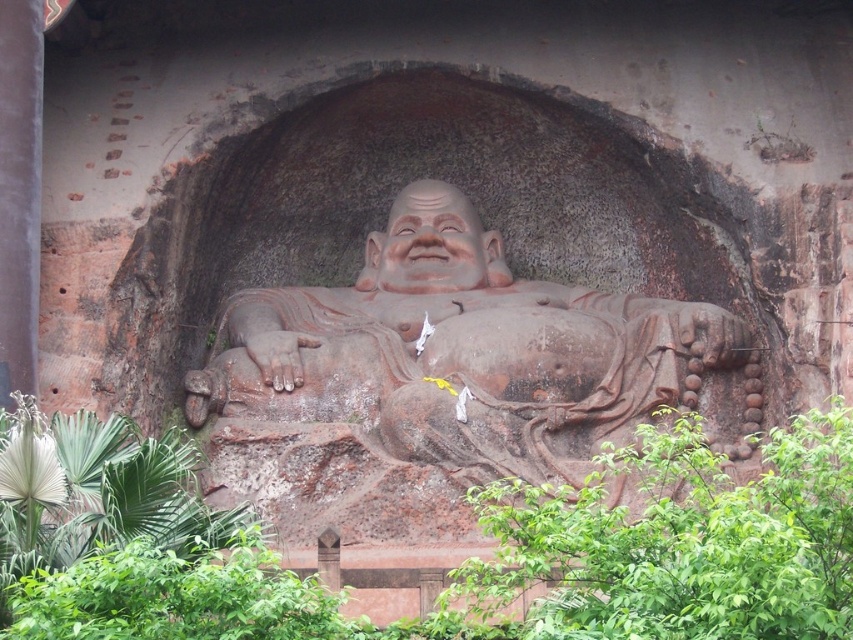
You are a tourist standing in front of the statue of the reclining Buddha. You notice the green leafy plant at lower center and the matte clay face at center. Which object is nearer to you?

The green leafy plant at lower center is closer to the viewer than the matte clay face at center.

You are a tourist standing in front of the statue of the reclining Buddha. You notice two objects in the scene. One is the brown stone statue at center and the other is the matte clay face at center. Which object is positioned to the right of the other?

The brown stone statue at center is to the right of the matte clay face at center.

You are standing at the base of the Buddha statue and want to water the green leafy plant at lower center. If your watering can has a range of 50 meters, will you be able to reach it?

The green leafy plant at lower center and viewer are 49.47 meters apart from each other. Since the watering can has a range of 50 meters, you can reach the green leafy plant at lower center because 49.47 meters is within the 50 meters range.